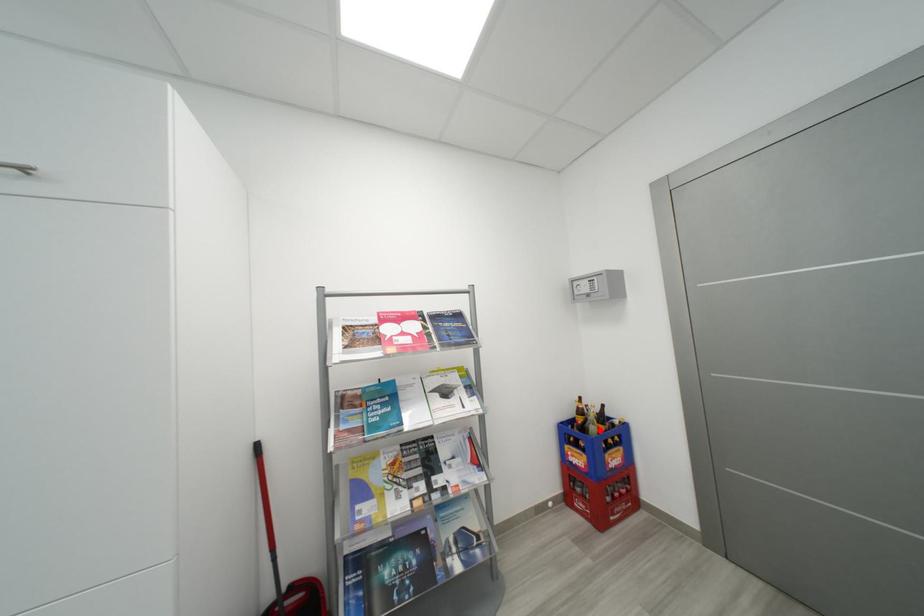
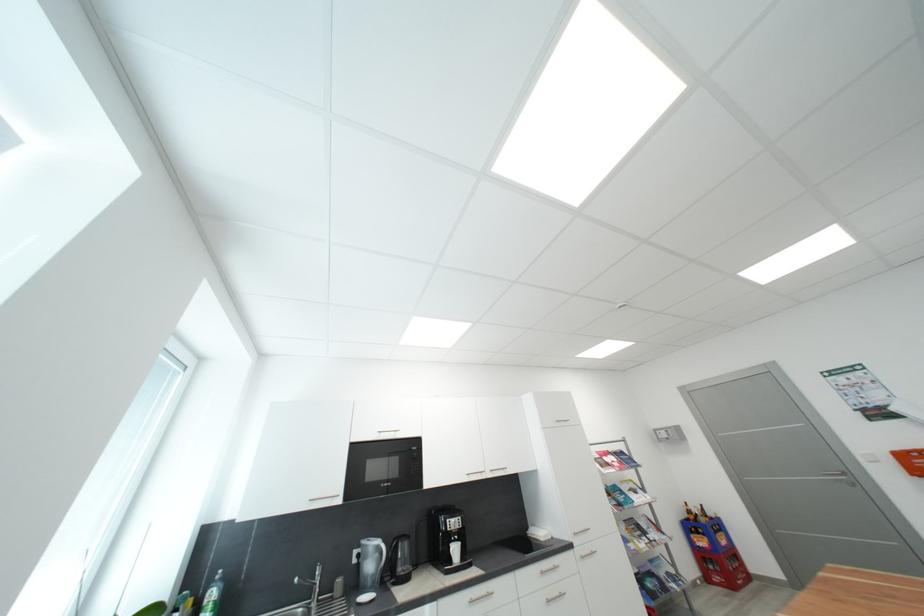
Question: I am providing you with two images of the same scene from different viewpoints. Image1 has a red point marked. In image2, the corresponding 3D location appears at what relative position? Reply with the corresponding letter.

Choices:
 (A) Closer
 (B) Farther

Answer: (A)